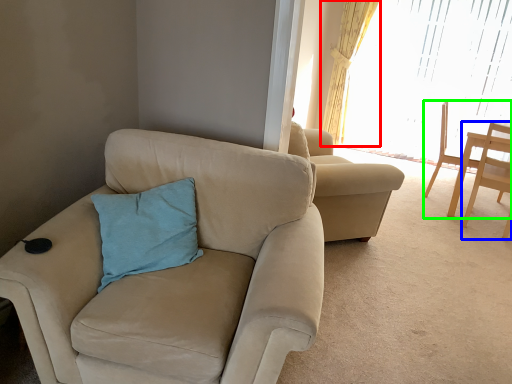
Question: Which object is the closest to the curtain (highlighted by a red box)? Choose among these: chair (highlighted by a blue box) or chair (highlighted by a green box).

Choices:
 (A) chair
 (B) chair

Answer: (B)